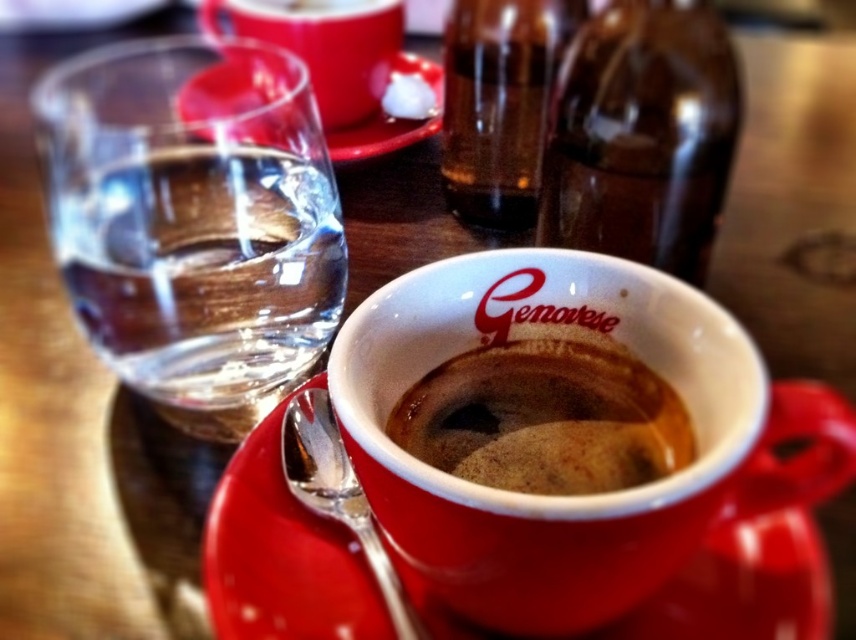
You are a barista preparing drinks and need to place both the transparent glass at left and the brown matte coffee at center on a shelf. The shelf has a height limit of 15 cm. Can both items fit vertically on the shelf without exceeding the height limit?

The transparent glass at left has a larger size compared to brown matte coffee at center. Since the transparent glass at left is larger, it likely exceeds the 15 cm height limit, so only the brown matte coffee at center may fit vertically on the shelf.

You are a barista who needs to place a new menu board on the wall behind the red ceramic cup labeled Genovese. The menu board is 0.3 meters wide. The point where you need to place it is at coordinate point (193, 220). Is there enough space between the transparent glass at left and the red ceramic cup labeled Genovese to place the menu board there?

The transparent glass at left is located at point (193, 220). Since the menu board is 0.3 meters wide, and the point is exactly where the glass is placed, there isn t enough space to place the menu board there without overlapping the glass.

You are a barista who needs to place a new menu board between the transparent glass at left and the brown matte coffee at center. The menu board requires 4 inches of space. Can you fit it between them?

The distance between the transparent glass at left and the brown matte coffee at center is 3.91 inches, which is slightly less than the required 4 inches. Therefore, the menu board cannot be placed between them without overlapping.